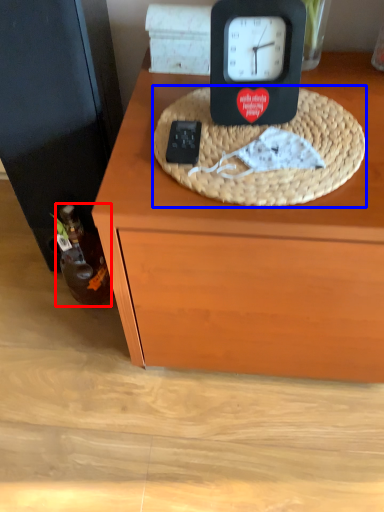
Question: Which object is closer to the camera taking this photo, bottle (highlighted by a red box) or basket (highlighted by a blue box)?

Choices:
 (A) bottle
 (B) basket

Answer: (B)